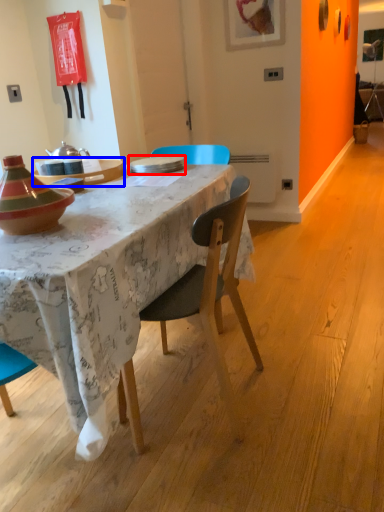
Question: Which object is closer to the camera taking this photo, plate (highlighted by a red box) or table (highlighted by a blue box)?

Choices:
 (A) plate
 (B) table

Answer: (B)